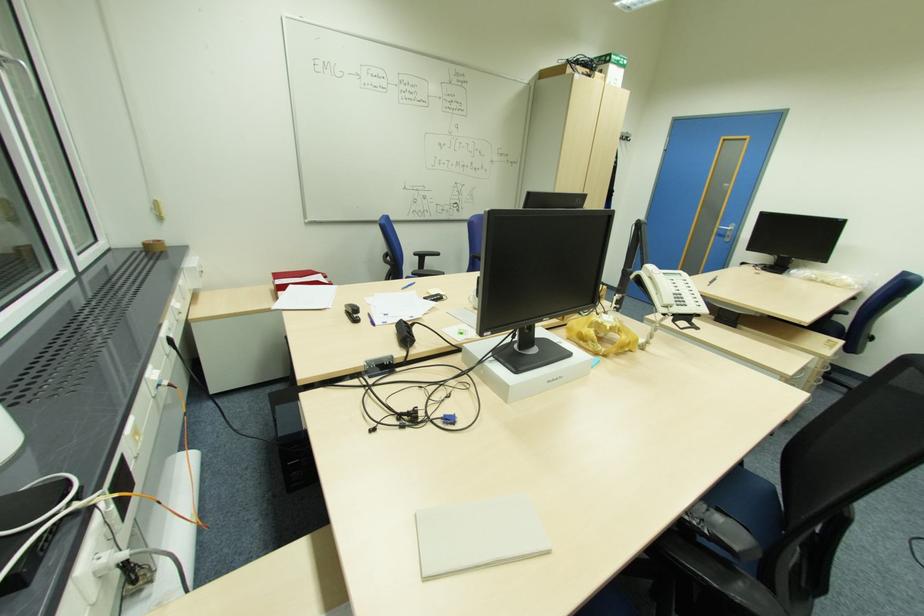
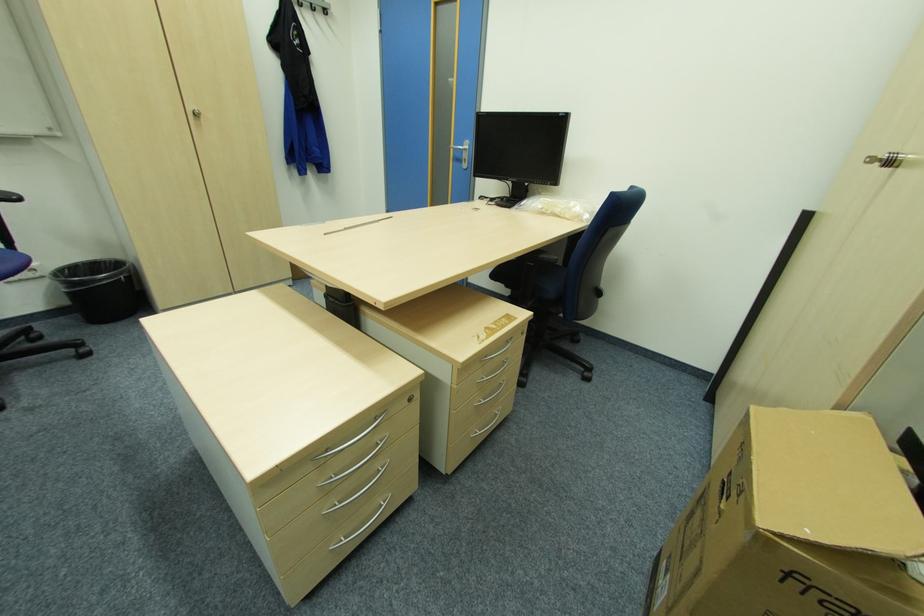
The point at (734, 229) is marked in the first image. Where is the corresponding point in the second image?

(468, 148)